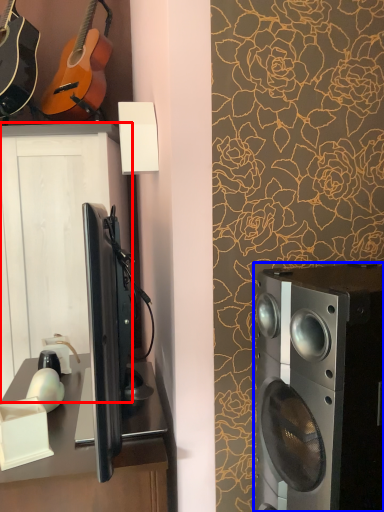
Question: Which point is closer to the camera, cabinetry (highlighted by a red box) or home appliance (highlighted by a blue box)?

Choices:
 (A) cabinetry
 (B) home appliance

Answer: (B)